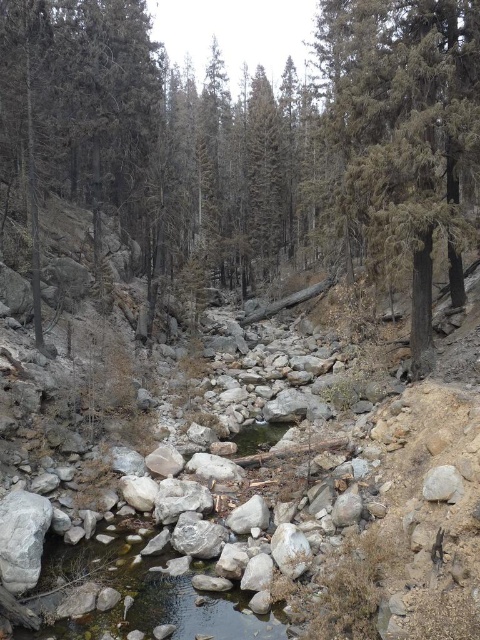
You are standing at the origin point of the image coordinate system. You want to cross the stream but need to know the exact 2D coordinates of the gray rock stream at center to plan your path. What are the coordinates?

The gray rock stream at center is located at coordinates (148, 596).